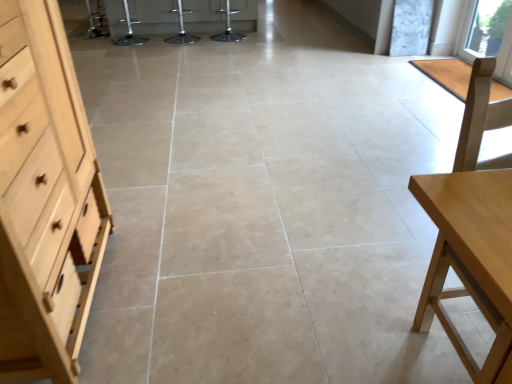
Question: Which direction should I rotate to look at metallic silver bar stool at center, arranged as the second bar stool when viewed from the left?

Choices:
 (A) left
 (B) right

Answer: (A)

Question: Does metallic silver bar stool at center, which is the 2th bar stool from right to left, have a lesser height compared to light wood table at right?

Choices:
 (A) no
 (B) yes

Answer: (B)

Question: Does metallic silver bar stool at center, arranged as the second bar stool when viewed from the left, have a larger size compared to light wood table at right?

Choices:
 (A) no
 (B) yes

Answer: (A)

Question: Is metallic silver bar stool at center, arranged as the second bar stool when viewed from the left, positioned before light wood table at right?

Choices:
 (A) yes
 (B) no

Answer: (B)

Question: Is metallic silver bar stool at center, arranged as the second bar stool when viewed from the left, positioned far away from light wood table at right?

Choices:
 (A) yes
 (B) no

Answer: (A)

Question: Does metallic silver bar stool at center, which is the 2th bar stool from right to left, have a lesser width compared to light wood table at right?

Choices:
 (A) no
 (B) yes

Answer: (A)

Question: Could you tell me if metallic silver bar stool at center, which is the 2th bar stool from right to left, is turned towards light wood table at right?

Choices:
 (A) no
 (B) yes

Answer: (A)

Question: From a real-world perspective, is transparent glass window at upper right located beneath metallic silver bar stool at center, which is the third bar stool from left to right?

Choices:
 (A) no
 (B) yes

Answer: (A)

Question: Does transparent glass window at upper right touch metallic silver bar stool at center, the 1th bar stool positioned from the right?

Choices:
 (A) yes
 (B) no

Answer: (B)

Question: Is transparent glass window at upper right oriented towards metallic silver bar stool at center, the 1th bar stool positioned from the right?

Choices:
 (A) yes
 (B) no

Answer: (B)

Question: Does transparent glass window at upper right have a lesser width compared to metallic silver bar stool at center, which is the third bar stool from left to right?

Choices:
 (A) yes
 (B) no

Answer: (A)

Question: From the image's perspective, is transparent glass window at upper right located above metallic silver bar stool at center, the 1th bar stool positioned from the right?

Choices:
 (A) yes
 (B) no

Answer: (B)

Question: Can you confirm if transparent glass window at upper right is positioned to the left of metallic silver bar stool at center, the 1th bar stool positioned from the right?

Choices:
 (A) yes
 (B) no

Answer: (B)

Question: Is metallic silver bar stool at center, the 1th bar stool positioned from the right, oriented away from transparent glass window at upper right?

Choices:
 (A) no
 (B) yes

Answer: (A)